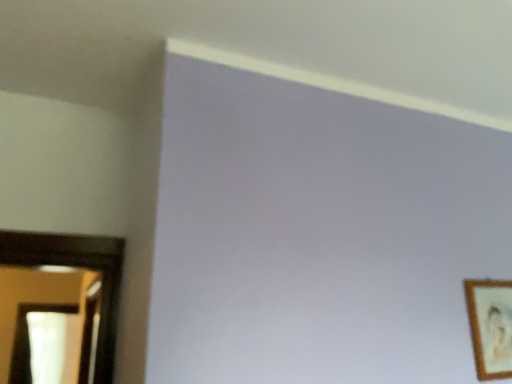
Image resolution: width=512 pixels, height=384 pixels. What are the coordinates of `wooden framed picture at right` in the screenshot? It's located at 490,326.

The width and height of the screenshot is (512, 384). What do you see at coordinates (490, 326) in the screenshot?
I see `wooden framed picture at right` at bounding box center [490, 326].

Identify the location of wooden framed picture at right. The height and width of the screenshot is (384, 512). (490, 326).